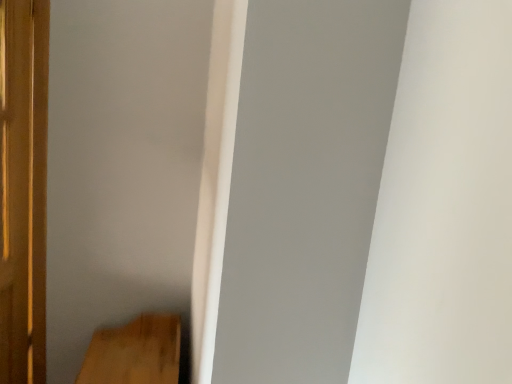
Where is `wooden table at lower left`? wooden table at lower left is located at coordinates (135, 352).

Image resolution: width=512 pixels, height=384 pixels. What do you see at coordinates (135, 352) in the screenshot?
I see `wooden table at lower left` at bounding box center [135, 352].

Measure the distance between wooden table at lower left and camera.

They are 1.70 meters apart.

Locate an element on the screen. This screenshot has width=512, height=384. wooden table at lower left is located at coordinates (135, 352).